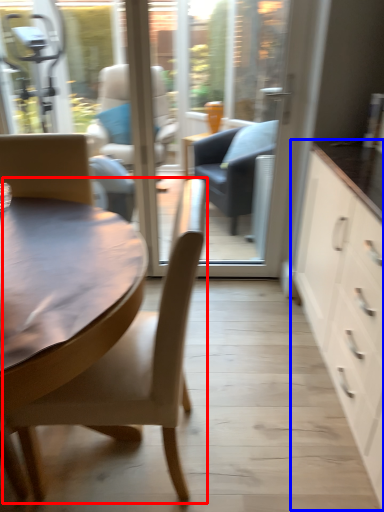
Question: Which point is further to the camera, chair (highlighted by a red box) or cabinetry (highlighted by a blue box)?

Choices:
 (A) chair
 (B) cabinetry

Answer: (A)